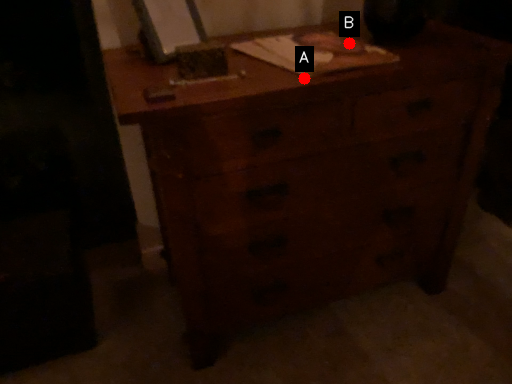
Question: Two points are circled on the image, labeled by A and B beside each circle. Among these points, which one is farthest from the camera?

Choices:
 (A) A is further
 (B) B is further

Answer: (B)